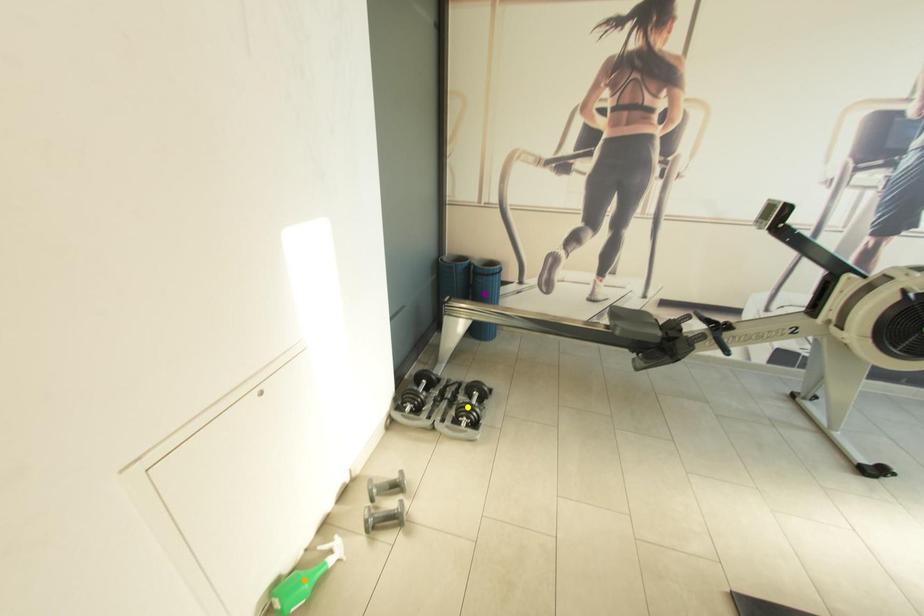
Order these from nearest to farthest:
A) yellow point
B) purple point
C) orange point

orange point → yellow point → purple point